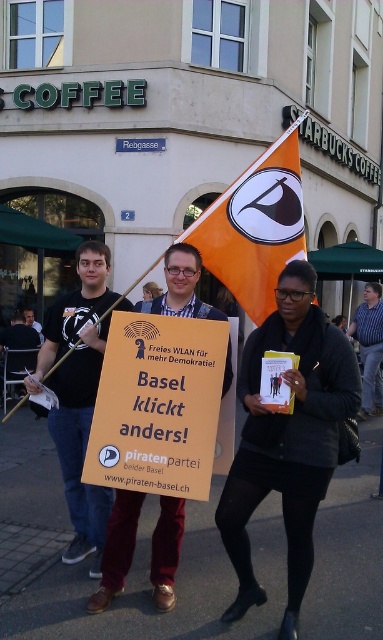
Where is `black matte jacket at center`? black matte jacket at center is located at coordinates (288, 438).

In the scene shown: Is black matte jacket at center closer to camera compared to yellow paper sign at center?

That is False.

Identify the location of black matte jacket at center. This screenshot has width=383, height=640. (288, 438).

Can you confirm if yellow paper sign at center is smaller than black fabric sign at center?

Correct, yellow paper sign at center occupies less space than black fabric sign at center.

Is yellow paper sign at center behind black fabric sign at center?

No, yellow paper sign at center is in front of black fabric sign at center.

Describe the element at coordinates (158, 404) in the screenshot. The image size is (383, 640). I see `yellow paper sign at center` at that location.

Where is `yellow paper sign at center`? The height and width of the screenshot is (640, 383). yellow paper sign at center is located at coordinates (158, 404).

Does black matte jacket at center have a lesser width compared to blue plaid shirt at center?

In fact, black matte jacket at center might be wider than blue plaid shirt at center.

Image resolution: width=383 pixels, height=640 pixels. In order to click on black matte jacket at center in this screenshot , I will do `click(288, 438)`.

The height and width of the screenshot is (640, 383). I want to click on black matte jacket at center, so click(x=288, y=438).

Where is `black matte jacket at center`? The width and height of the screenshot is (383, 640). black matte jacket at center is located at coordinates (288, 438).